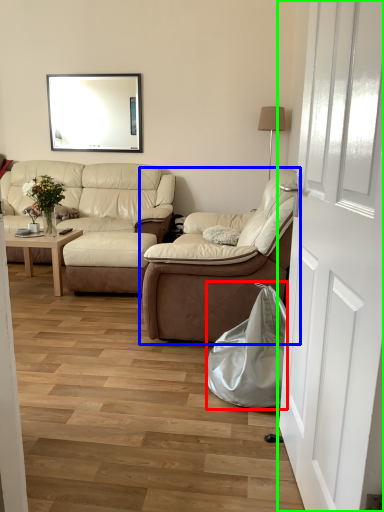
Question: Which object is the farthest from material (highlighted by a red box)? Choose among these: studio couch (highlighted by a blue box) or door (highlighted by a green box).

Choices:
 (A) studio couch
 (B) door

Answer: (B)